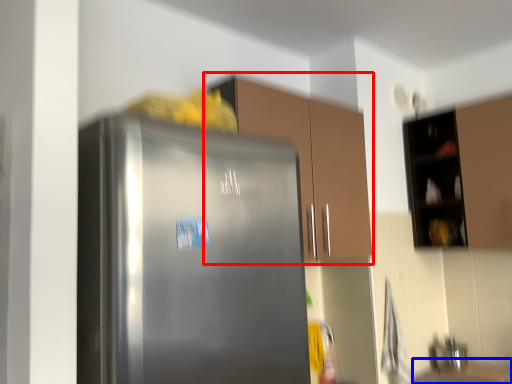
Question: Which object is closer to the camera taking this photo, cabinetry (highlighted by a red box) or counter top (highlighted by a blue box)?

Choices:
 (A) cabinetry
 (B) counter top

Answer: (A)